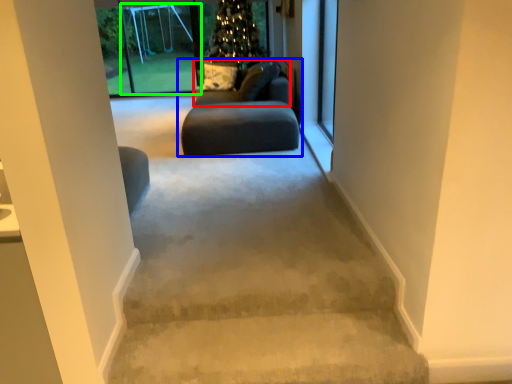
Question: Estimate the real-world distances between objects in this image. Which object is farther from couch (highlighted by a red box), studio couch (highlighted by a blue box) or screen door (highlighted by a green box)?

Choices:
 (A) studio couch
 (B) screen door

Answer: (B)